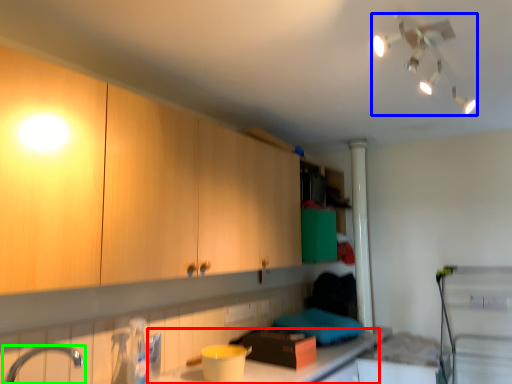
Question: Based on their relative distances, which object is farther from countertop (highlighted by a red box)? Choose from light fixture (highlighted by a blue box) and tap (highlighted by a green box).

Choices:
 (A) light fixture
 (B) tap

Answer: (A)